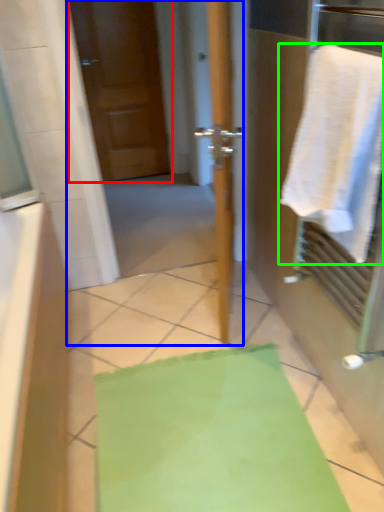
Question: Estimate the real-world distances between objects in this image. Which object is closer to door (highlighted by a red box), screen door (highlighted by a blue box) or towel (highlighted by a green box)?

Choices:
 (A) screen door
 (B) towel

Answer: (A)